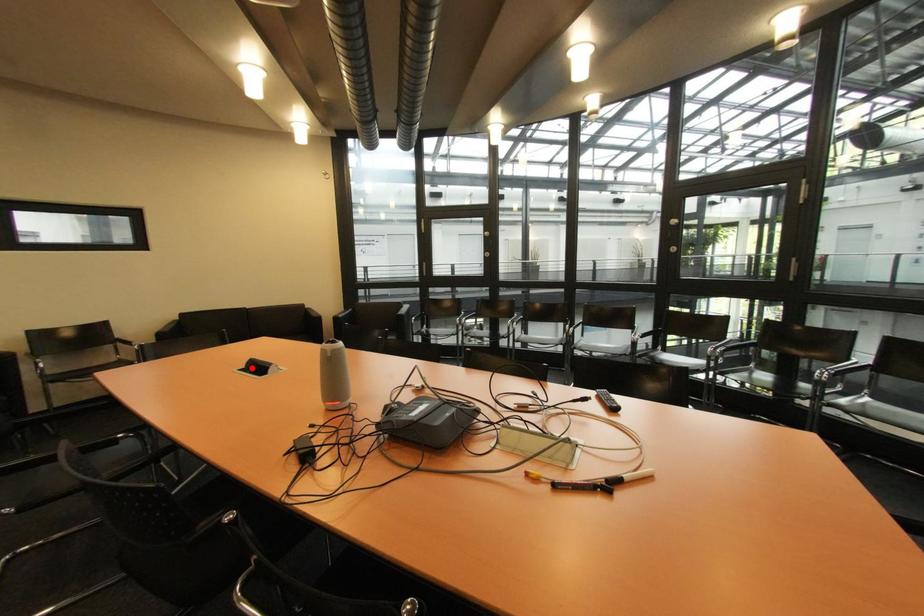
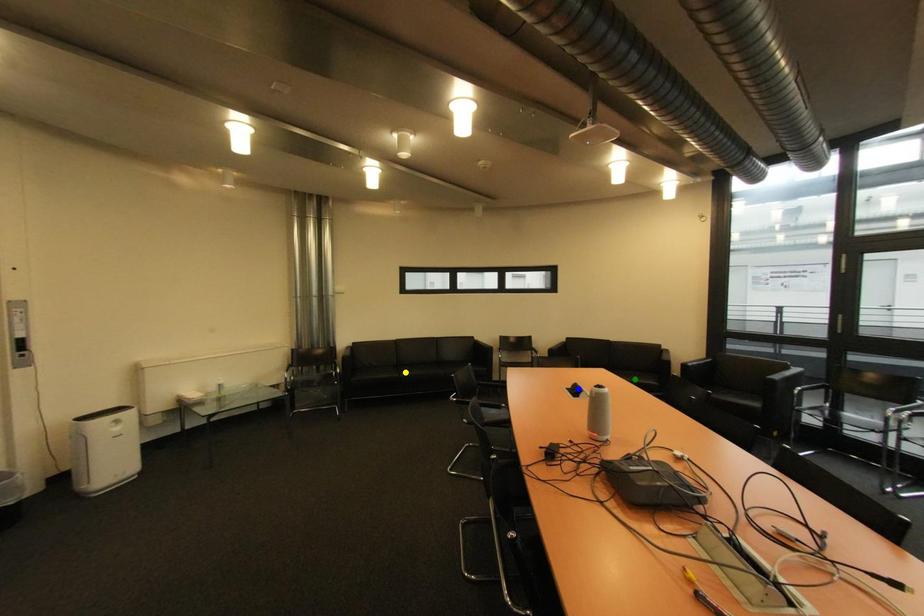
Question: I am providing you with two images of the same scene from different viewpoints. A red point is marked on the first image. You are given multiple points on the second image. Which point in image 2 is actually the same real-world point as the red point in image 1?

Choices:
 (A) yellow point
 (B) blue point
 (C) green point

Answer: (B)